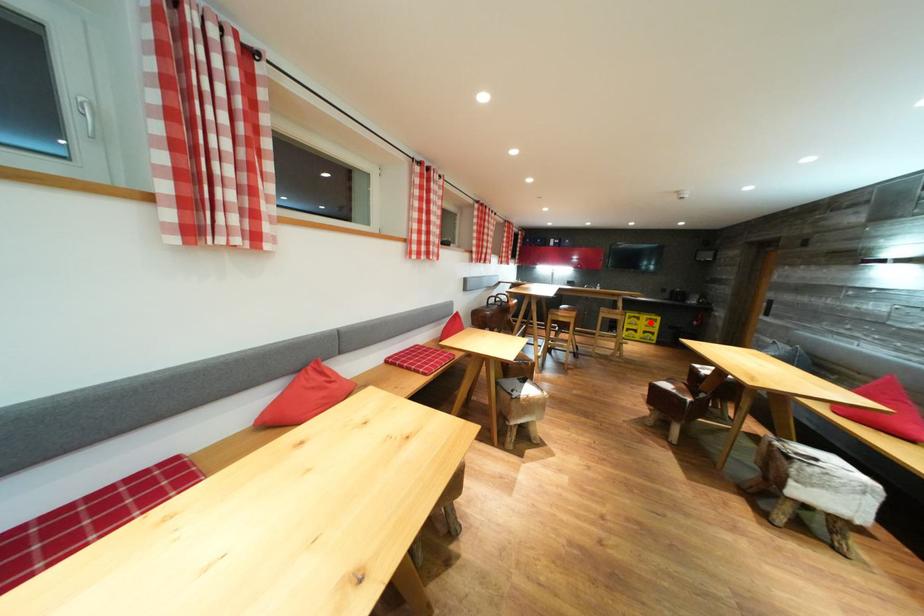
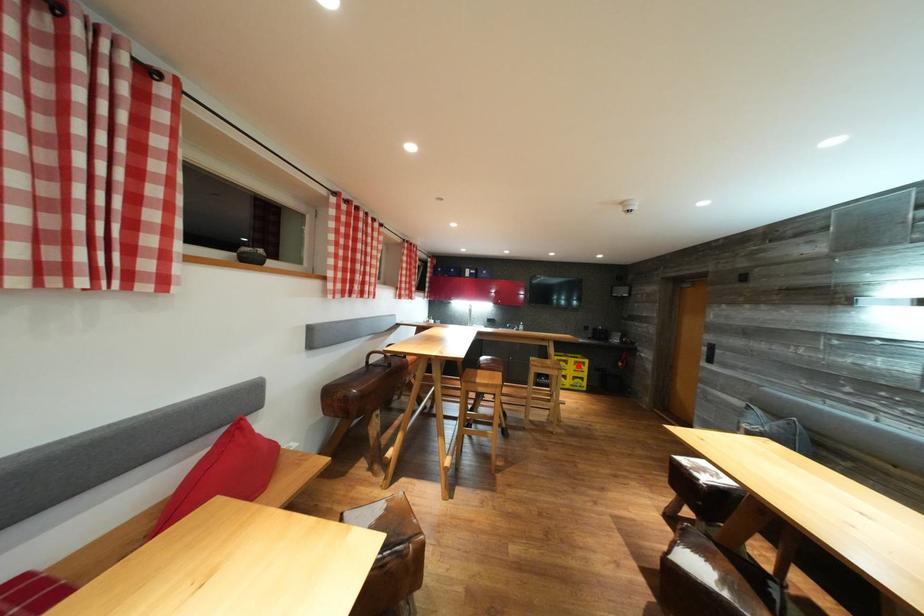
I am providing you with two images of the same scene from different viewpoints. A red point is marked on the first image and another point is marked on the second image. Are the points marked in image1 and image2 representing the same 3D position?

Yes